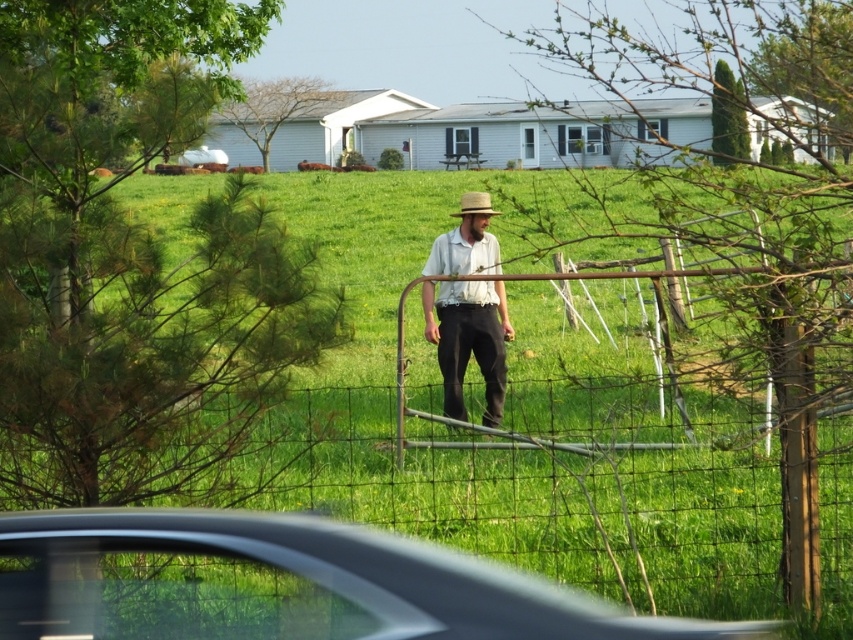
You are planning to place a small garden gnome exactly where the green grass at center and woven straw hat at center are located. Which area has enough space to accommodate the gnome without overlapping the other object?

The green grass at center is wider than the woven straw hat at center, so placing the garden gnome on the green grass at center would provide sufficient space without overlapping the woven straw hat at center.

You are a drone operator trying to capture a photo of the green grass at center and the woven straw hat at center from above. What is the minimum distance the drone needs to fly to ensure both objects are in frame?

The minimum distance the drone needs to fly is 15.47 feet to ensure both the green grass at center and the woven straw hat at center are in frame.